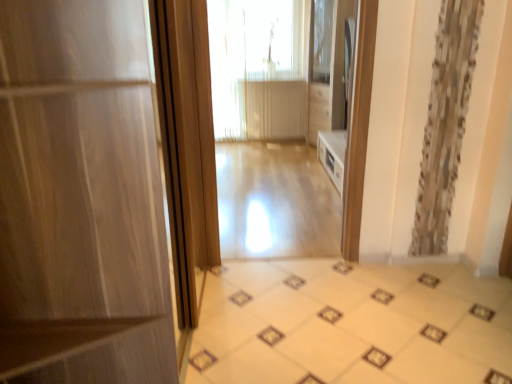
Question: Can you confirm if light wood floor at center is smaller than light wood floor at center?

Choices:
 (A) no
 (B) yes

Answer: (A)

Question: Are light wood floor at center and light wood floor at center making contact?

Choices:
 (A) yes
 (B) no

Answer: (B)

Question: From a real-world perspective, is light wood floor at center over light wood floor at center?

Choices:
 (A) no
 (B) yes

Answer: (A)

Question: Is light wood floor at center inside light wood floor at center?

Choices:
 (A) yes
 (B) no

Answer: (B)

Question: Is light wood floor at center turned away from light wood floor at center?

Choices:
 (A) yes
 (B) no

Answer: (B)

Question: Is light wood floor at center bigger or smaller than translucent fabric at center?

Choices:
 (A) small
 (B) big

Answer: (A)

Question: Is light wood floor at center taller or shorter than translucent fabric at center?

Choices:
 (A) short
 (B) tall

Answer: (A)

Question: From a real-world perspective, is light wood floor at center above or below translucent fabric at center?

Choices:
 (A) below
 (B) above

Answer: (A)

Question: In terms of width, does light wood floor at center look wider or thinner when compared to translucent fabric at center?

Choices:
 (A) thin
 (B) wide

Answer: (B)

Question: Considering the positions of translucent fabric at center and matte wood door at left in the image, is translucent fabric at center taller or shorter than matte wood door at left?

Choices:
 (A) tall
 (B) short

Answer: (A)

Question: Considering the positions of point (281, 102) and point (30, 81), is point (281, 102) closer or farther from the camera than point (30, 81)?

Choices:
 (A) closer
 (B) farther

Answer: (B)

Question: In the image, is translucent fabric at center on the left side or the right side of matte wood door at left?

Choices:
 (A) right
 (B) left

Answer: (A)

Question: Considering the positions of translucent fabric at center and matte wood door at left in the image, is translucent fabric at center bigger or smaller than matte wood door at left?

Choices:
 (A) small
 (B) big

Answer: (A)

Question: Considering the positions of light wood floor at center and matte wood door at left in the image, is light wood floor at center wider or thinner than matte wood door at left?

Choices:
 (A) wide
 (B) thin

Answer: (B)

Question: Relative to matte wood door at left, is light wood floor at center in front or behind?

Choices:
 (A) behind
 (B) front

Answer: (A)